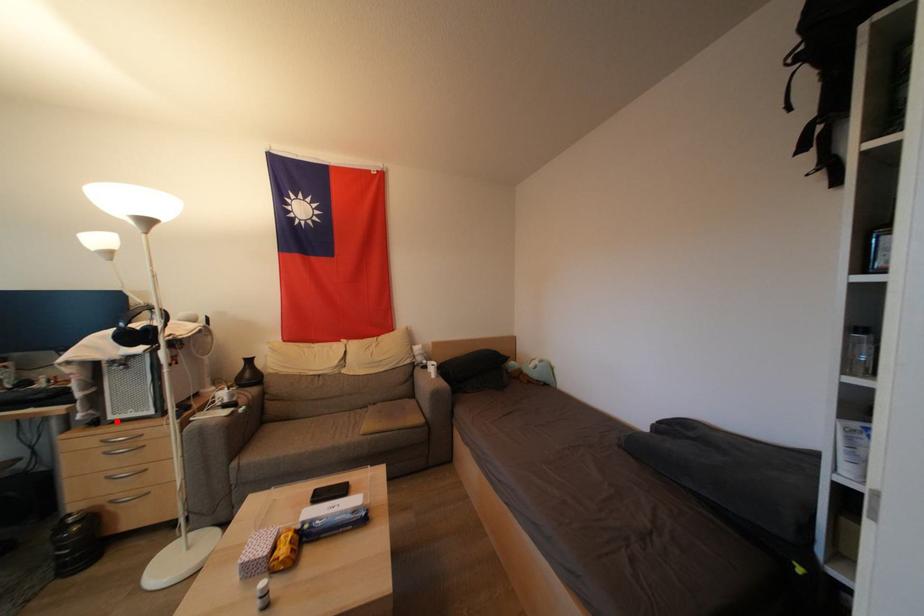
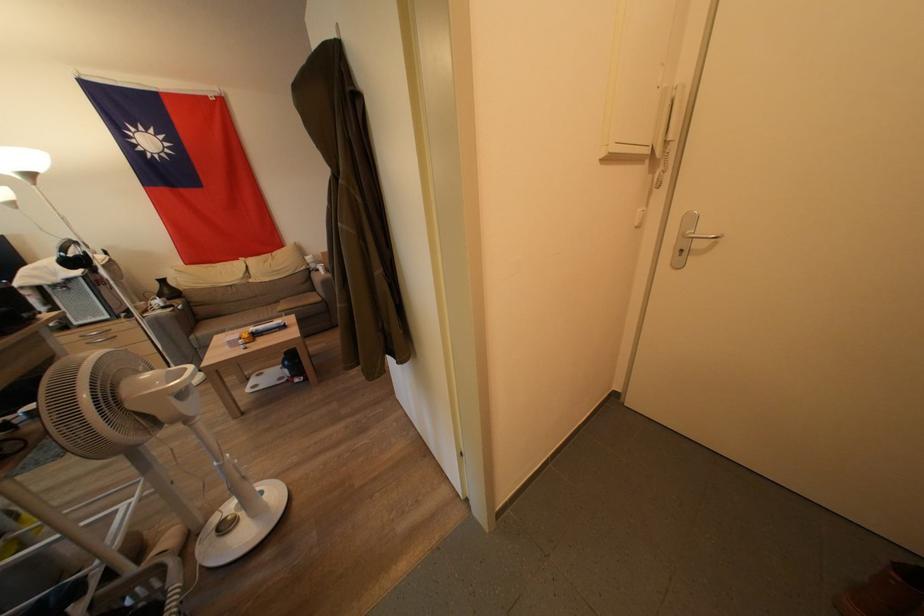
Where in the second image is the point corresponding to the highlighted location from the first image?

(81, 328)